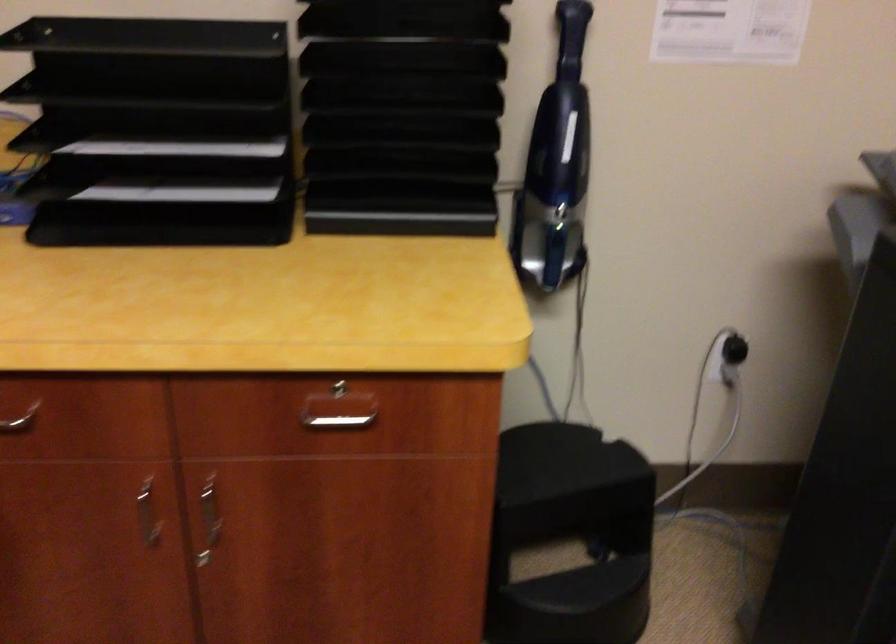
Locate an element on the screen. This screenshot has width=896, height=644. vacuum cleaner handle is located at coordinates (571, 37).